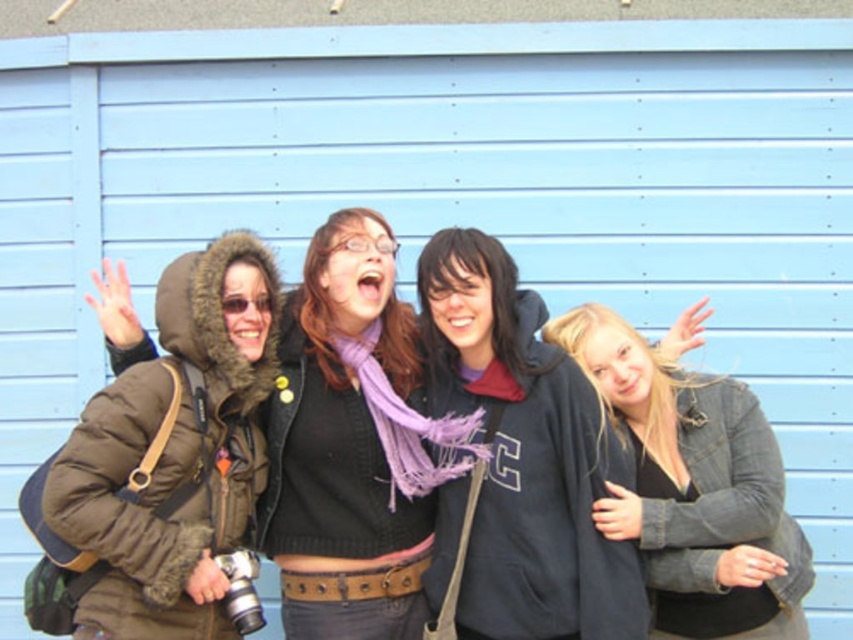
Is dark gray hoodie at center thinner than blonde hair at right?

Indeed, dark gray hoodie at center has a lesser width compared to blonde hair at right.

The image size is (853, 640). Describe the element at coordinates (525, 456) in the screenshot. I see `dark gray hoodie at center` at that location.

Image resolution: width=853 pixels, height=640 pixels. I want to click on dark gray hoodie at center, so click(525, 456).

Can you confirm if dark gray hoodie at center is positioned to the left of matte brown jacket at left?

In fact, dark gray hoodie at center is to the right of matte brown jacket at left.

Which is behind, point (482, 275) or point (270, 342)?

The point (270, 342) is more distant.

This screenshot has width=853, height=640. I want to click on dark gray hoodie at center, so click(525, 456).

Consider the image. Can you confirm if matte brown jacket at left is shorter than blonde hair at right?

Incorrect, matte brown jacket at left's height does not fall short of blonde hair at right's.

Which is in front, point (192, 580) or point (651, 472)?

Point (192, 580) is in front.

Measure the distance between point (x=204, y=356) and camera.

The distance of point (x=204, y=356) from camera is 2.85 meters.

At what (x,y) coordinates should I click in order to perform the action: click on matte brown jacket at left. Please return your answer as a coordinate pair (x, y). This screenshot has height=640, width=853. Looking at the image, I should click on (175, 451).